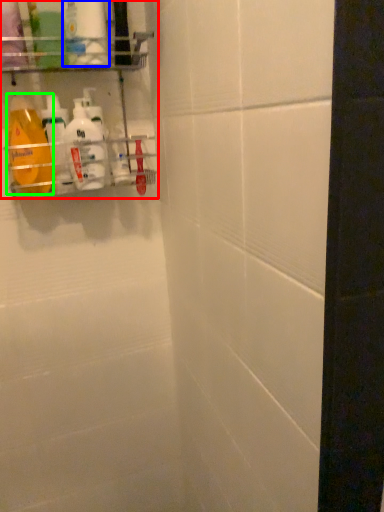
Question: Estimate the real-world distances between objects in this image. Which object is farther from shelf (highlighted by a red box), cleaning product (highlighted by a blue box) or cleaning product (highlighted by a green box)?

Choices:
 (A) cleaning product
 (B) cleaning product

Answer: (A)